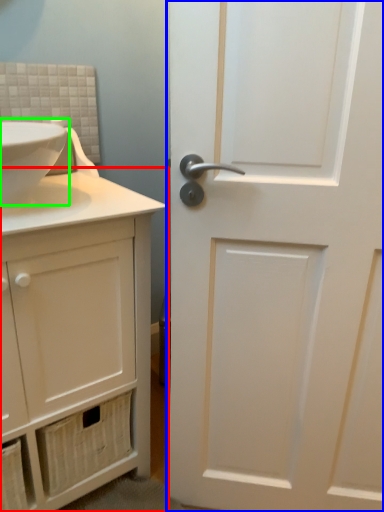
Question: Which object is positioned farthest from bathroom cabinet (highlighted by a red box)? Select from door (highlighted by a blue box) and sink (highlighted by a green box).

Choices:
 (A) door
 (B) sink

Answer: (B)